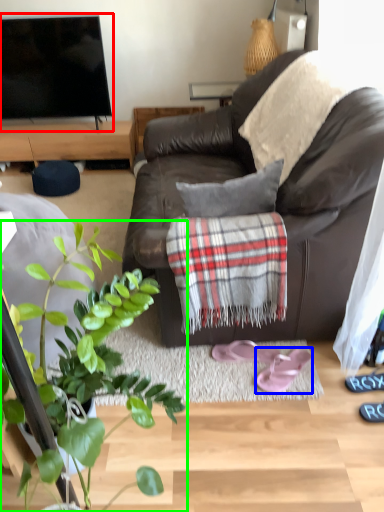
Question: Which object is positioned closest to television (highlighted by a red box)? Select from footwear (highlighted by a blue box) and houseplant (highlighted by a green box).

Choices:
 (A) footwear
 (B) houseplant

Answer: (B)